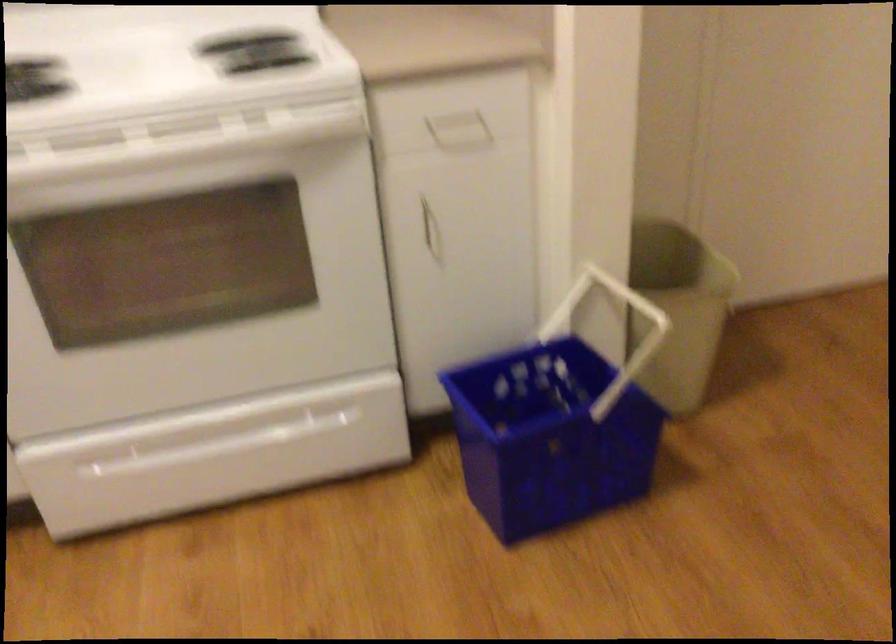
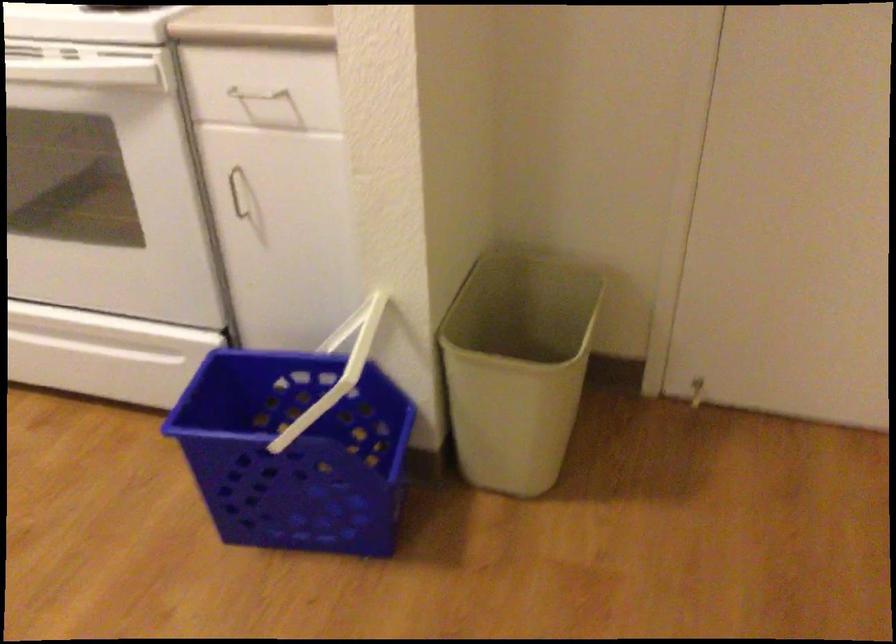
The point at (555,308) is marked in the first image. Where is the corresponding point in the second image?

(346, 328)